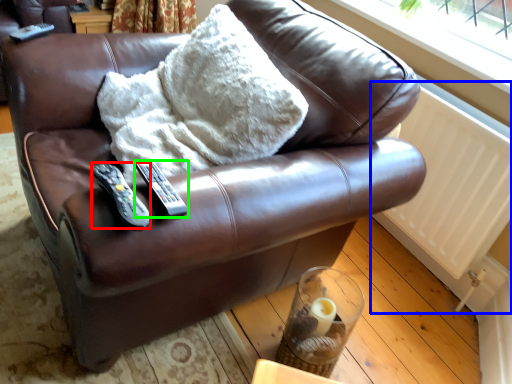
Question: Which is nearer to the remote (highlighted by a red box)? radiator (highlighted by a blue box) or remote (highlighted by a green box).

Choices:
 (A) radiator
 (B) remote

Answer: (B)